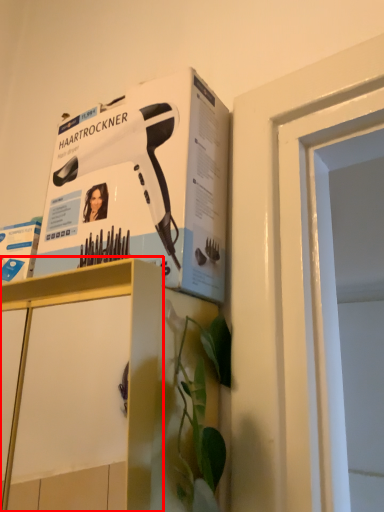
Question: From the image's perspective, where is cabinetry (annotated by the red box) located in relation to paperback book in the image?

Choices:
 (A) below
 (B) above

Answer: (A)